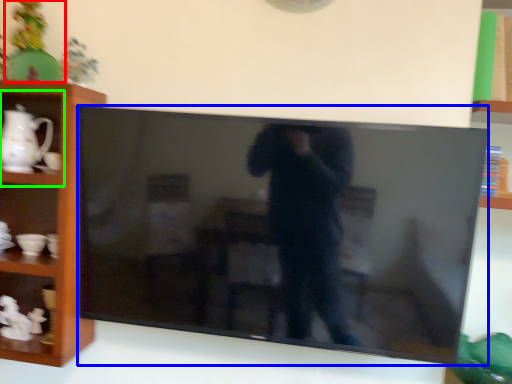
Question: Which object is positioned farthest from toy (highlighted by a red box)? Select from television (highlighted by a blue box) and cabinet (highlighted by a green box).

Choices:
 (A) television
 (B) cabinet

Answer: (A)